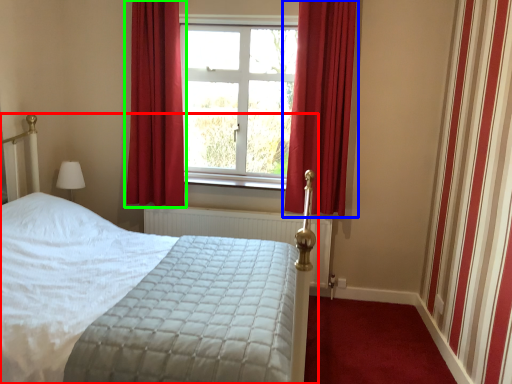
Question: Estimate the real-world distances between objects in this image. Which object is closer to bed (highlighted by a red box), curtain (highlighted by a blue box) or curtain (highlighted by a green box)?

Choices:
 (A) curtain
 (B) curtain

Answer: (A)